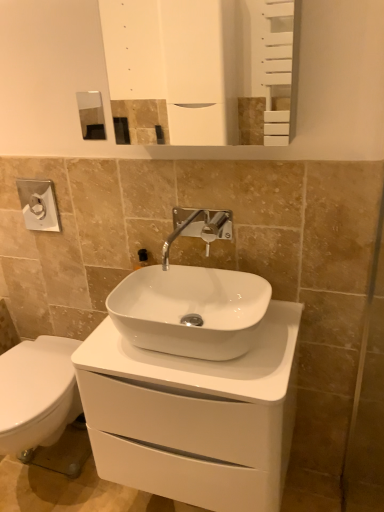
Question: Should I look upward or downward to see white glossy mirror at upper center?

Choices:
 (A) down
 (B) up

Answer: (B)

Question: From the image's perspective, is white glossy cabinet at center above satin nickel faucet at center?

Choices:
 (A) yes
 (B) no

Answer: (B)

Question: Considering the relative sizes of white glossy cabinet at center and satin nickel faucet at center in the image provided, is white glossy cabinet at center thinner than satin nickel faucet at center?

Choices:
 (A) no
 (B) yes

Answer: (A)

Question: Does white glossy cabinet at center have a greater height compared to satin nickel faucet at center?

Choices:
 (A) no
 (B) yes

Answer: (B)

Question: Does white glossy cabinet at center have a lesser height compared to satin nickel faucet at center?

Choices:
 (A) yes
 (B) no

Answer: (B)

Question: Is white glossy cabinet at center not inside satin nickel faucet at center?

Choices:
 (A) yes
 (B) no

Answer: (A)

Question: Does white glossy cabinet at center turn towards satin nickel faucet at center?

Choices:
 (A) no
 (B) yes

Answer: (A)

Question: From the image's perspective, is white glossy sink at center below white glossy cabinet at center?

Choices:
 (A) yes
 (B) no

Answer: (B)

Question: Considering the relative sizes of white glossy sink at center and white glossy cabinet at center in the image provided, is white glossy sink at center taller than white glossy cabinet at center?

Choices:
 (A) no
 (B) yes

Answer: (A)

Question: Does white glossy sink at center appear on the right side of white glossy cabinet at center?

Choices:
 (A) no
 (B) yes

Answer: (A)

Question: Does white glossy sink at center touch white glossy cabinet at center?

Choices:
 (A) yes
 (B) no

Answer: (B)

Question: Could you tell me if white glossy sink at center is facing white glossy cabinet at center?

Choices:
 (A) no
 (B) yes

Answer: (A)

Question: Does white glossy sink at center come behind white glossy cabinet at center?

Choices:
 (A) yes
 (B) no

Answer: (A)

Question: Does satin nickel faucet at center appear on the left side of white glossy mirror at upper center?

Choices:
 (A) no
 (B) yes

Answer: (B)